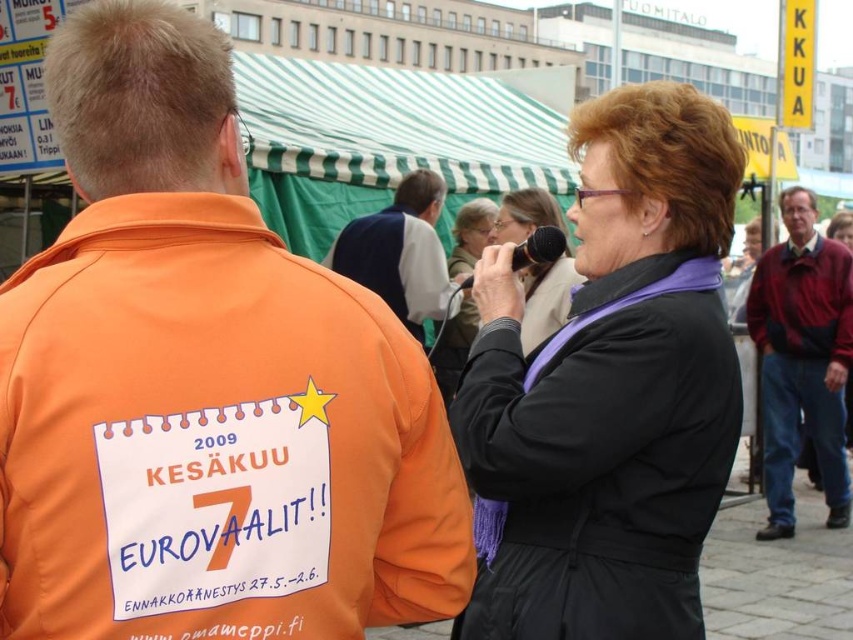
Who is more distant from viewer, [833,392] or [408,248]?

The point [833,392] is behind.

Does maroon sweater at upper right have a larger size compared to dark blue vest at center?

Actually, maroon sweater at upper right might be smaller than dark blue vest at center.

Between point (816, 298) and point (405, 298), which one is positioned behind?

Point (816, 298)

Find the location of a particular element. Image resolution: width=853 pixels, height=640 pixels. maroon sweater at upper right is located at coordinates (802, 358).

What do you see at coordinates (802, 358) in the screenshot? The width and height of the screenshot is (853, 640). I see `maroon sweater at upper right` at bounding box center [802, 358].

Is maroon sweater at upper right further to camera compared to black plastic microphone at upper center?

That is True.

Locate an element on the screen. Image resolution: width=853 pixels, height=640 pixels. maroon sweater at upper right is located at coordinates (802, 358).

Identify the location of maroon sweater at upper right. (802, 358).

The image size is (853, 640). Describe the element at coordinates (202, 385) in the screenshot. I see `orange fabric jacket at left` at that location.

Does orange fabric jacket at left have a greater height compared to black matte jacket at center?

In fact, orange fabric jacket at left may be shorter than black matte jacket at center.

Is point (158, 205) behind point (544, 547)?

No, it is in front of (544, 547).

In order to click on orange fabric jacket at left in this screenshot , I will do `click(202, 385)`.